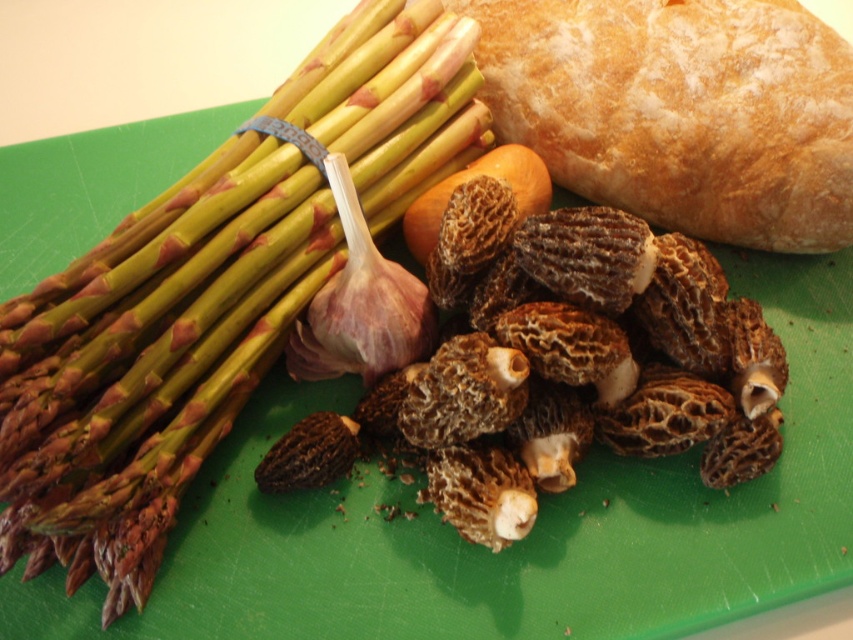
Can you confirm if green matte asparagus at left is shorter than brown fibrous mushrooms at center?

Incorrect, green matte asparagus at left's height does not fall short of brown fibrous mushrooms at center's.

Where is `green matte asparagus at left`? The width and height of the screenshot is (853, 640). green matte asparagus at left is located at coordinates (212, 294).

You are a GUI agent. You are given a task and a screenshot of the screen. Output one action in this format:
    pyautogui.click(x=<x>, y=<y>)
    Task: Click on the brown fibrous mushrooms at center
    The image size is (853, 640).
    Given the screenshot: What is the action you would take?
    pyautogui.click(x=589, y=342)

Is point (527, 524) behind point (357, 353)?

No, it is not.

Find the location of a particular element. brown fibrous mushrooms at center is located at coordinates (589, 342).

Between golden brown crusty loaf at upper right and purple papery garlic at center, which one is positioned higher?

golden brown crusty loaf at upper right is higher up.

Which is behind, point (637, 132) or point (340, 220)?

Point (637, 132)

Locate an element on the screen. The width and height of the screenshot is (853, 640). golden brown crusty loaf at upper right is located at coordinates (682, 109).